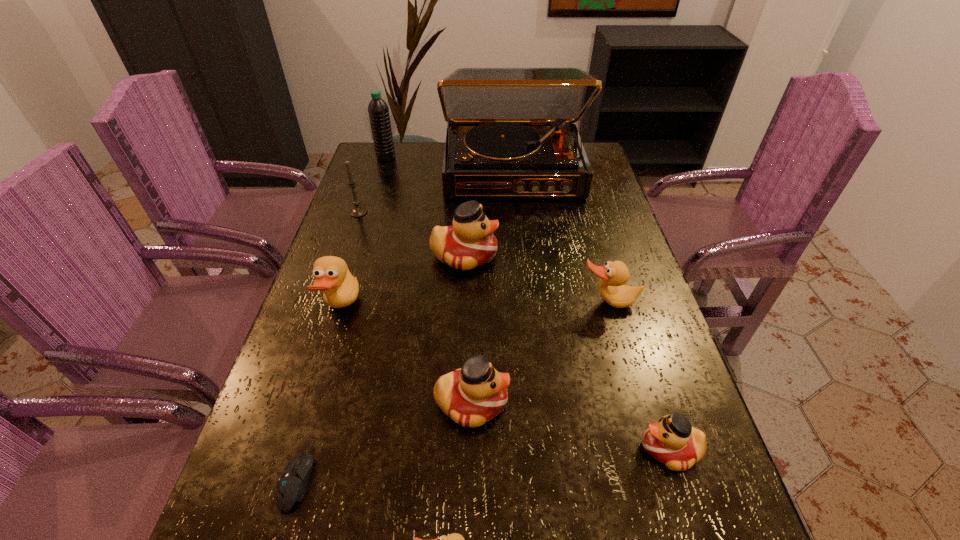
The image size is (960, 540). Find the location of `the second smallest tan duck`. the second smallest tan duck is located at coordinates (613, 275).

Find the location of a particular element. This screenshot has height=540, width=960. the rightmost red duck is located at coordinates (672, 441).

Locate an element on the screen. This screenshot has width=960, height=540. the shortest object is located at coordinates (291, 487).

Locate an element on the screen. The width and height of the screenshot is (960, 540). vacant area located 0.250m on the front-facing side of the record player is located at coordinates (521, 258).

Where is `free space located on the right of the second tallest object`? free space located on the right of the second tallest object is located at coordinates (410, 158).

Locate an element on the screen. vacant space located 0.230m on the right of the candle is located at coordinates (444, 212).

Where is `vacant space located 0.050m on the face of the biggest red duck`? The width and height of the screenshot is (960, 540). vacant space located 0.050m on the face of the biggest red duck is located at coordinates (516, 255).

Where is `vacant space located 0.050m on the beak of the leftmost tan duck`? vacant space located 0.050m on the beak of the leftmost tan duck is located at coordinates (379, 308).

You are a GUI agent. You are given a task and a screenshot of the screen. Output one action in this format:
    pyautogui.click(x=<x>, y=<y>)
    Task: Click on the blank area located 0.210m on the face of the second biggest red duck
    This screenshot has width=960, height=540.
    Given the screenshot: What is the action you would take?
    pyautogui.click(x=614, y=403)

At what (x,y) coordinates should I click in order to perform the action: click on vacant space located 0.220m on the beak of the rightmost tan duck. Please return your answer as a coordinate pair (x, y). The image size is (960, 540). Looking at the image, I should click on (635, 396).